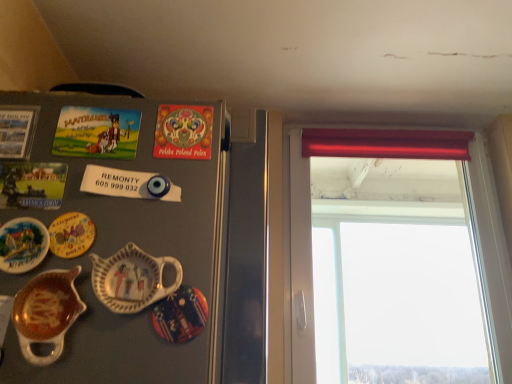
The width and height of the screenshot is (512, 384). I want to click on matte ceramic gravy boat at lower left, the second tableware when ordered from right to left, so click(47, 313).

The width and height of the screenshot is (512, 384). What are the coordinates of `matte ceramic plate at left, acting as the 2th plate starting from the right` in the screenshot? It's located at pyautogui.click(x=71, y=235).

The image size is (512, 384). What do you see at coordinates (132, 279) in the screenshot?
I see `decorative ceramic pitcher at left, which is the 1th tableware in right-to-left order` at bounding box center [132, 279].

This screenshot has height=384, width=512. In order to click on matte ceramic gravy boat at lower left, which appears as the 1th tableware when viewed from the left in this screenshot , I will do `click(47, 313)`.

From a real-world perspective, is smooth plastic window at right beneath matte ceramic plate at left, acting as the third plate starting from the right?

No.

In the scene shown: In the image, is smooth plastic window at right positioned in front of or behind matte ceramic plate at left, acting as the first plate starting from the left?

Visually, smooth plastic window at right is located behind matte ceramic plate at left, acting as the first plate starting from the left.

Is smooth plastic window at right positioned far away from matte ceramic plate at left, acting as the first plate starting from the left?

smooth plastic window at right is far away from matte ceramic plate at left, acting as the first plate starting from the left.

From the image's perspective, which object appears higher, smooth plastic window at right or matte ceramic plate at left, acting as the first plate starting from the left?

From the image's view, matte ceramic plate at left, acting as the first plate starting from the left, is above.

Is matte ceramic gravy boat at lower left, which appears as the 1th tableware when viewed from the left, bigger than decorative ceramic pitcher at left, marked as the second tableware in a left-to-right arrangement?

Indeed, matte ceramic gravy boat at lower left, which appears as the 1th tableware when viewed from the left, has a larger size compared to decorative ceramic pitcher at left, marked as the second tableware in a left-to-right arrangement.

Measure the distance between matte ceramic gravy boat at lower left, which appears as the 1th tableware when viewed from the left, and decorative ceramic pitcher at left, which is the 1th tableware in right-to-left order.

matte ceramic gravy boat at lower left, which appears as the 1th tableware when viewed from the left, is 2.04 inches from decorative ceramic pitcher at left, which is the 1th tableware in right-to-left order.

Considering the relative positions of matte ceramic gravy boat at lower left, the second tableware when ordered from right to left, and decorative ceramic pitcher at left, marked as the second tableware in a left-to-right arrangement, in the image provided, is matte ceramic gravy boat at lower left, the second tableware when ordered from right to left, to the right of decorative ceramic pitcher at left, marked as the second tableware in a left-to-right arrangement, from the viewer's perspective?

In fact, matte ceramic gravy boat at lower left, the second tableware when ordered from right to left, is to the left of decorative ceramic pitcher at left, marked as the second tableware in a left-to-right arrangement.

Considering the points (326, 132) and (199, 324), which point is behind, point (326, 132) or point (199, 324)?

The point (326, 132) is behind.

The image size is (512, 384). In order to click on curtain that is on the right side of multicolored ceramic plate at center, the 1th plate when ordered from right to left in this screenshot , I will do `click(386, 143)`.

Can you confirm if red velvet curtain at upper center is positioned to the right of multicolored ceramic plate at center, the 1th plate when ordered from right to left?

Correct, you'll find red velvet curtain at upper center to the right of multicolored ceramic plate at center, the 1th plate when ordered from right to left.

Are red velvet curtain at upper center and multicolored ceramic plate at center, the 1th plate when ordered from right to left, located far from each other?

red velvet curtain at upper center is far away from multicolored ceramic plate at center, the 1th plate when ordered from right to left.

Starting from the red velvet curtain at upper center, which tableware is the 1st one in front? Please provide its 2D coordinates.

[(132, 279)]

Is red velvet curtain at upper center inside decorative ceramic pitcher at left, which is the 1th tableware in right-to-left order?

No, red velvet curtain at upper center is not surrounded by decorative ceramic pitcher at left, which is the 1th tableware in right-to-left order.

From a real-world perspective, between decorative ceramic pitcher at left, marked as the second tableware in a left-to-right arrangement, and red velvet curtain at upper center, who is vertically higher?

From a 3D spatial view, red velvet curtain at upper center is above.

Considering the sizes of matte ceramic plate at left, acting as the first plate starting from the left, and matte ceramic plate at left, acting as the 2th plate starting from the right, in the image, is matte ceramic plate at left, acting as the first plate starting from the left, wider or thinner than matte ceramic plate at left, acting as the 2th plate starting from the right,?

Considering their sizes, matte ceramic plate at left, acting as the first plate starting from the left, looks slimmer than matte ceramic plate at left, acting as the 2th plate starting from the right.

The image size is (512, 384). Identify the location of plate that is the 1st object located in front of the matte ceramic plate at left, marked as the second plate in a left-to-right arrangement. (23, 245).

Is matte ceramic plate at left, acting as the first plate starting from the left, not within matte ceramic plate at left, marked as the second plate in a left-to-right arrangement?

matte ceramic plate at left, acting as the first plate starting from the left, is positioned outside matte ceramic plate at left, marked as the second plate in a left-to-right arrangement.

Is point (34, 251) positioned before point (58, 226)?

Yes.

From a real-world perspective, relative to matte ceramic plate at left, marked as the second plate in a left-to-right arrangement, is smooth plastic window at right vertically above or below?

smooth plastic window at right is situated higher than matte ceramic plate at left, marked as the second plate in a left-to-right arrangement, in the real world.

Considering their positions, is smooth plastic window at right located in front of or behind matte ceramic plate at left, marked as the second plate in a left-to-right arrangement?

Visually, smooth plastic window at right is located behind matte ceramic plate at left, marked as the second plate in a left-to-right arrangement.

Would you say smooth plastic window at right is inside or outside matte ceramic plate at left, marked as the second plate in a left-to-right arrangement?

smooth plastic window at right cannot be found inside matte ceramic plate at left, marked as the second plate in a left-to-right arrangement.

Does smooth plastic window at right touch matte ceramic plate at left, acting as the 2th plate starting from the right?

smooth plastic window at right and matte ceramic plate at left, acting as the 2th plate starting from the right, are not in contact.

Considering their positions, is red velvet curtain at upper center located in front of or behind decorative ceramic pitcher at left, marked as the second tableware in a left-to-right arrangement?

Visually, red velvet curtain at upper center is located behind decorative ceramic pitcher at left, marked as the second tableware in a left-to-right arrangement.

What's the angular difference between red velvet curtain at upper center and decorative ceramic pitcher at left, which is the 1th tableware in right-to-left order,'s facing directions?

The angle between the facing direction of red velvet curtain at upper center and the facing direction of decorative ceramic pitcher at left, which is the 1th tableware in right-to-left order, is 0.368 degrees.

Between point (356, 152) and point (152, 274), which one is positioned in front?

The point (152, 274) is more forward.

In order to click on the 3rd plate to the left when counting from the smooth plastic window at right in this screenshot , I will do `click(23, 245)`.

The width and height of the screenshot is (512, 384). Find the location of `tableware below the decorative ceramic pitcher at left, marked as the second tableware in a left-to-right arrangement (from the image's perspective)`. tableware below the decorative ceramic pitcher at left, marked as the second tableware in a left-to-right arrangement (from the image's perspective) is located at coordinates (47, 313).

From the picture: Looking at the image, which one is located further to matte ceramic gravy boat at lower left, which appears as the 1th tableware when viewed from the left, multicolored ceramic plate at center, the 1th plate when ordered from right to left, or matte ceramic plate at left, acting as the 2th plate starting from the right?

multicolored ceramic plate at center, the 1th plate when ordered from right to left, is positioned further to the anchor matte ceramic gravy boat at lower left, which appears as the 1th tableware when viewed from the left.

Looking at this image, from the image, which object appears to be nearer to matte ceramic plate at left, acting as the 2th plate starting from the right, matte ceramic plate at left, acting as the third plate starting from the right, or matte ceramic gravy boat at lower left, the second tableware when ordered from right to left?

Based on the image, matte ceramic plate at left, acting as the third plate starting from the right, appears to be nearer to matte ceramic plate at left, acting as the 2th plate starting from the right.

Considering their positions, is matte ceramic gravy boat at lower left, the second tableware when ordered from right to left, positioned closer to red velvet curtain at upper center than matte ceramic plate at left, acting as the first plate starting from the left?

The object closer to red velvet curtain at upper center is matte ceramic gravy boat at lower left, the second tableware when ordered from right to left.

From the image, which object appears to be farther from smooth plastic window at right, multicolored ceramic plate at center, positioned as the third plate in left-to-right order, or matte ceramic gravy boat at lower left, which appears as the 1th tableware when viewed from the left?

Based on the image, matte ceramic gravy boat at lower left, which appears as the 1th tableware when viewed from the left, appears to be further to smooth plastic window at right.

Considering their positions, is matte ceramic gravy boat at lower left, which appears as the 1th tableware when viewed from the left, positioned further to smooth plastic window at right than decorative ceramic pitcher at left, which is the 1th tableware in right-to-left order?

matte ceramic gravy boat at lower left, which appears as the 1th tableware when viewed from the left.

Which object lies nearer to the anchor point matte ceramic gravy boat at lower left, which appears as the 1th tableware when viewed from the left, matte ceramic plate at left, marked as the second plate in a left-to-right arrangement, or matte ceramic plate at left, acting as the third plate starting from the right?

matte ceramic plate at left, acting as the third plate starting from the right.

Considering their positions, is multicolored ceramic plate at center, positioned as the third plate in left-to-right order, positioned further to matte ceramic plate at left, acting as the 2th plate starting from the right, than decorative ceramic pitcher at left, which is the 1th tableware in right-to-left order?

The object further to matte ceramic plate at left, acting as the 2th plate starting from the right, is multicolored ceramic plate at center, positioned as the third plate in left-to-right order.

Which object lies further to the anchor point matte ceramic plate at left, marked as the second plate in a left-to-right arrangement, matte ceramic gravy boat at lower left, the second tableware when ordered from right to left, or red velvet curtain at upper center?

red velvet curtain at upper center is further to matte ceramic plate at left, marked as the second plate in a left-to-right arrangement.

In order to click on window positioned between matte ceramic plate at left, acting as the 2th plate starting from the right, and red velvet curtain at upper center from near to far in this screenshot , I will do `click(397, 270)`.

Locate an element on the screen. This screenshot has height=384, width=512. plate between matte ceramic plate at left, marked as the second plate in a left-to-right arrangement, and matte ceramic gravy boat at lower left, the second tableware when ordered from right to left, vertically is located at coordinates (23, 245).

At what (x,y) coordinates should I click in order to perform the action: click on tableware located between matte ceramic gravy boat at lower left, the second tableware when ordered from right to left, and smooth plastic window at right in the depth direction. Please return your answer as a coordinate pair (x, y). This screenshot has width=512, height=384. Looking at the image, I should click on (132, 279).

I want to click on window between matte ceramic gravy boat at lower left, which appears as the 1th tableware when viewed from the left, and red velvet curtain at upper center, along the z-axis, so click(397, 270).